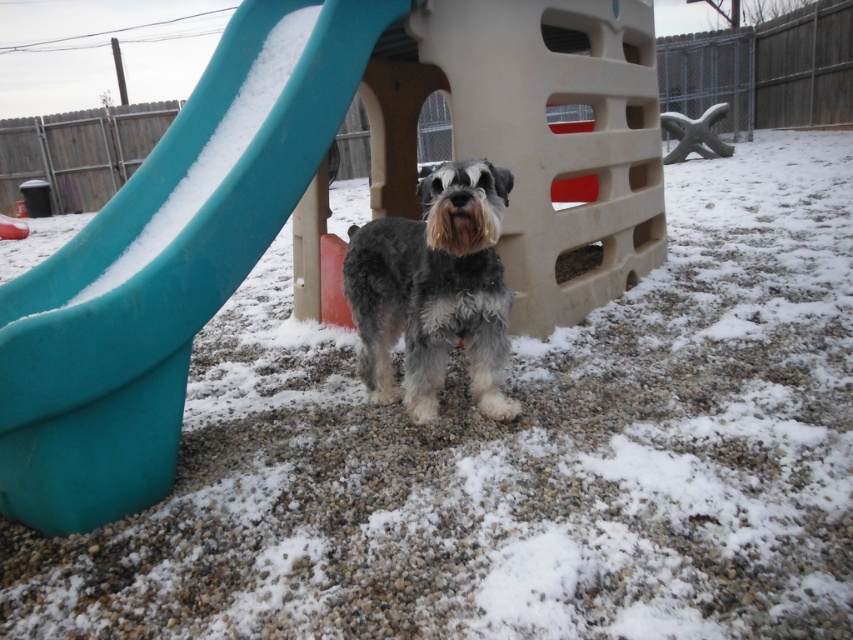
Between teal plastic slide at left and gray shaggy dog at center, which one appears on the left side from the viewer's perspective?

teal plastic slide at left

Is teal plastic slide at left taller than gray shaggy dog at center?

Yes.

Is point (172, 342) positioned after point (473, 168)?

No, (172, 342) is closer to viewer.

Locate an element on the screen. Image resolution: width=853 pixels, height=640 pixels. teal plastic slide at left is located at coordinates (166, 266).